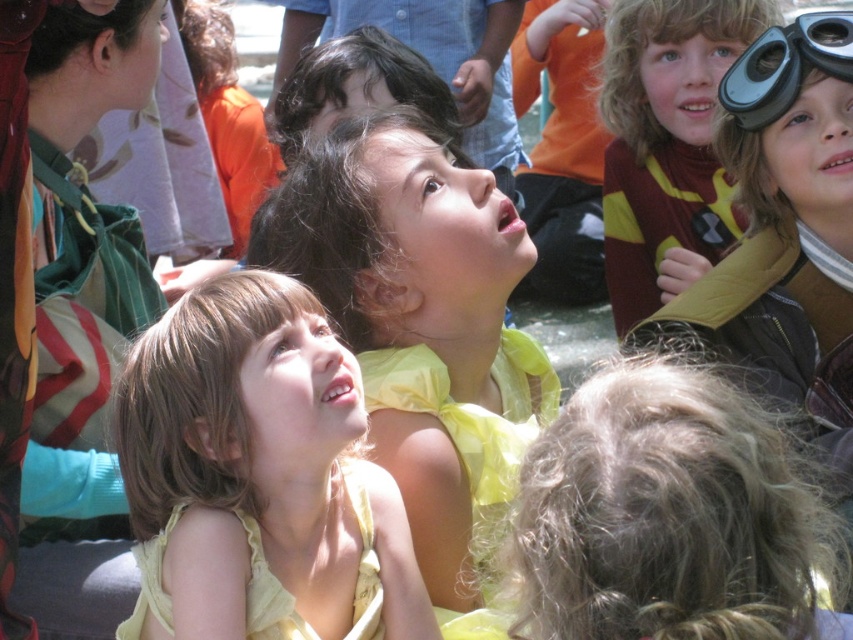
Is yellow fabric dress at center taller than black rubber goggles at upper right?

Indeed, yellow fabric dress at center has a greater height compared to black rubber goggles at upper right.

Is point (372, 588) less distant than point (787, 28)?

Yes, point (372, 588) is closer to viewer.

Does point (138, 448) come in front of point (775, 60)?

Yes, point (138, 448) is in front of point (775, 60).

This screenshot has height=640, width=853. In order to click on yellow fabric dress at center in this screenshot , I will do `click(258, 476)`.

Is yellow fabric dress at center closer to the viewer compared to yellow satin dress at center?

Yes, yellow fabric dress at center is in front of yellow satin dress at center.

From the picture: Who is more forward, (241, 586) or (502, 372)?

Point (241, 586) is in front.

Where is `yellow fabric dress at center`? yellow fabric dress at center is located at coordinates (258, 476).

Is matte brown sweater at upper right taller than black rubber goggles at upper right?

Yes.

In the scene shown: Who is lower down, matte brown sweater at upper right or black rubber goggles at upper right?

matte brown sweater at upper right

Between point (648, 285) and point (764, 51), which one is positioned behind?

The point (648, 285) is more distant.

Where is `matte brown sweater at upper right`? matte brown sweater at upper right is located at coordinates (666, 144).